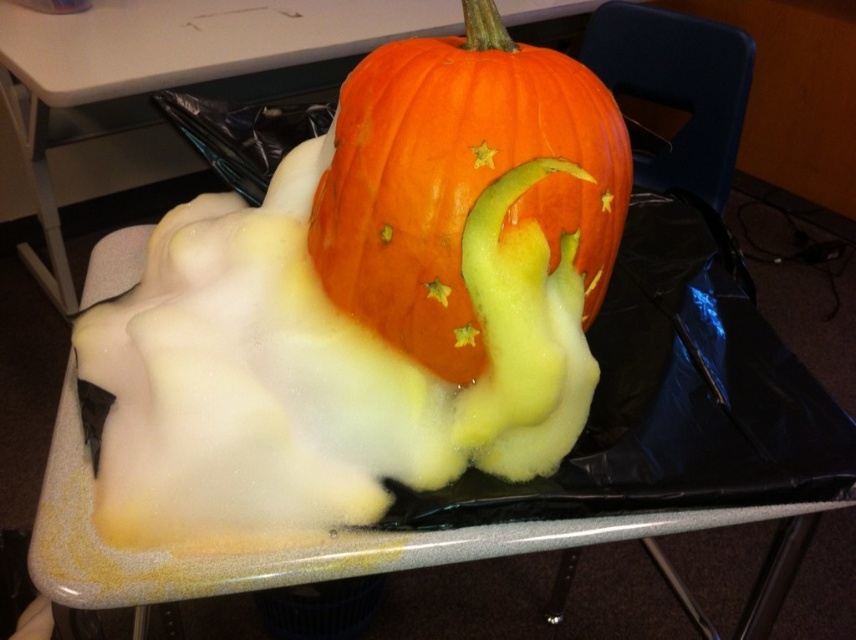
Looking at this image, you need to place a decorative item that is 15 cm wide on the smooth plastic table at center. Can the orange matte pumpkin at center fit alongside it without overlapping?

The orange matte pumpkin at center has a width less than the smooth plastic table at center. Since the decorative item is 15 cm wide and the pumpkin is smaller, there should be enough space for both on the table without overlapping, provided their combined width doesn

You are setting up a Halloween display and need to ensure the orange matte pumpkin at center fits on the smooth plastic table at center. Based on the scene, will the pumpkin fit comfortably without overhanging the edges?

The orange matte pumpkin at center has a smaller size compared to the smooth plastic table at center, so it should fit comfortably without overhanging the edges.

Consider the image. You are holding a 12 inch ruler and want to measure the distance from your camera to the point labeled point (568, 86). Can you determine if the ruler is long enough to reach that point?

The distance between point (568, 86) and the camera is 18.62 inches, so the 12 inch ruler is not long enough to reach the point labeled point (568, 86).